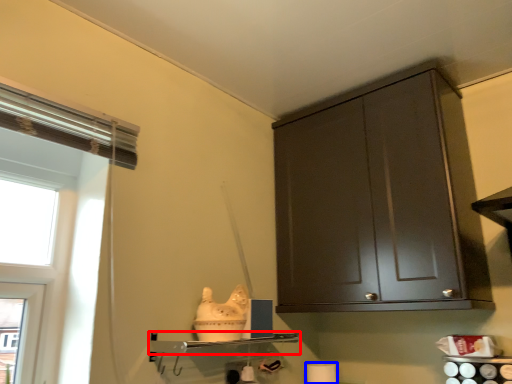
Question: Which point is closer to the camera, shelf (highlighted by a red box) or toilet paper (highlighted by a blue box)?

Choices:
 (A) shelf
 (B) toilet paper

Answer: (A)